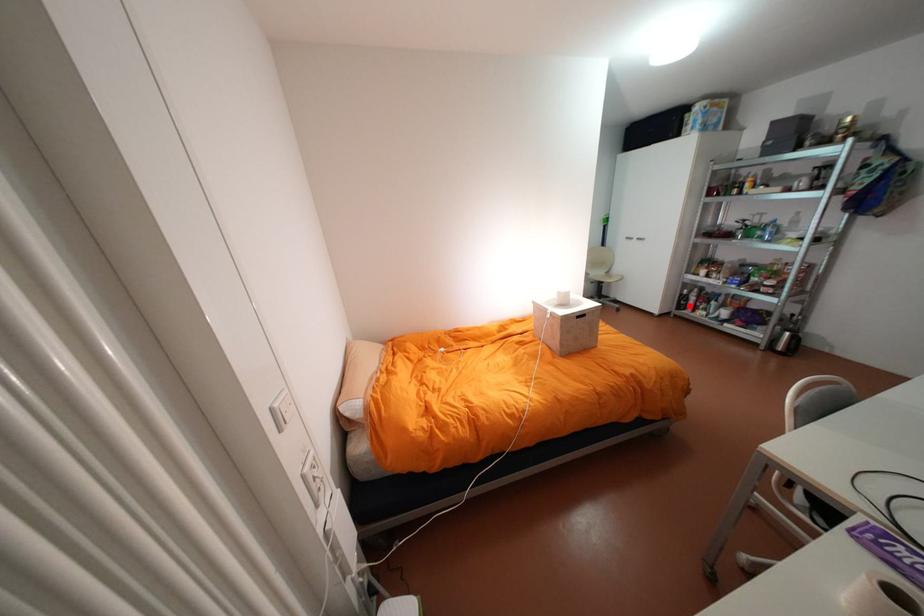
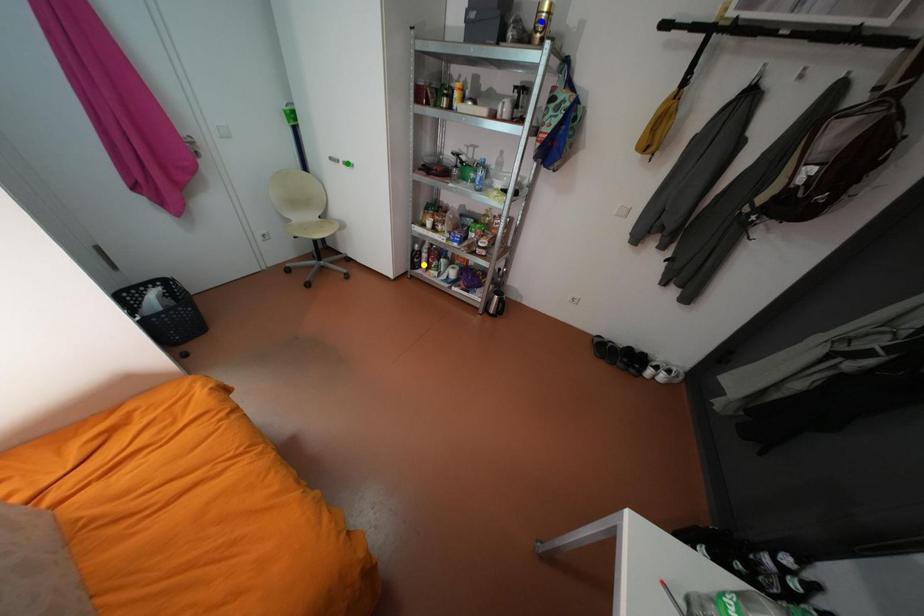
Question: I am providing you with two images of the same scene from different viewpoints. A red point is marked on the first image. You are given multiple points on the second image. Can you choose the point in image 2 that corresponds to the point in image 1?

Choices:
 (A) yellow point
 (B) blue point
 (C) green point

Answer: (A)